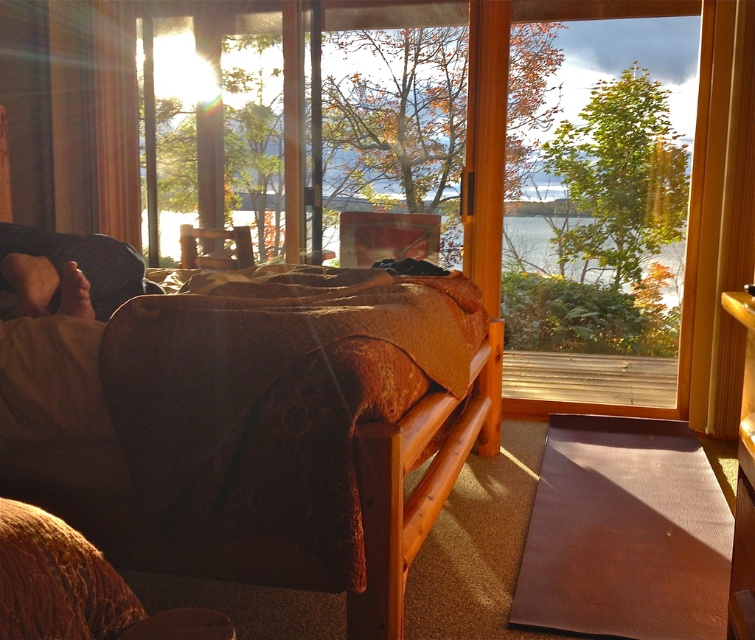
You are a guest in this room and want to place a tall plant next to the brown matte yoga mat at lower right so it doesn t block the view through the transparent glass window at center. Can you do that?

The brown matte yoga mat at lower right is not as tall as the transparent glass window at center, so placing a tall plant next to the brown matte yoga mat at lower right won t block the view through the transparent glass window at center.

You are a guest entering the room and want to sit on the velvet brown couch at lower left. However, there is a brown textured fabric at left nearby. Which one is shorter in height?

The velvet brown couch at lower left is shorter than the brown textured fabric at left.

You are standing in the room and want to pick up an item located at point [572,403] and another item at point [102,285]. Which item will you reach first?

You will reach the item at point [572,403] first because it is closer to you than the item at point [102,285], which is further away.